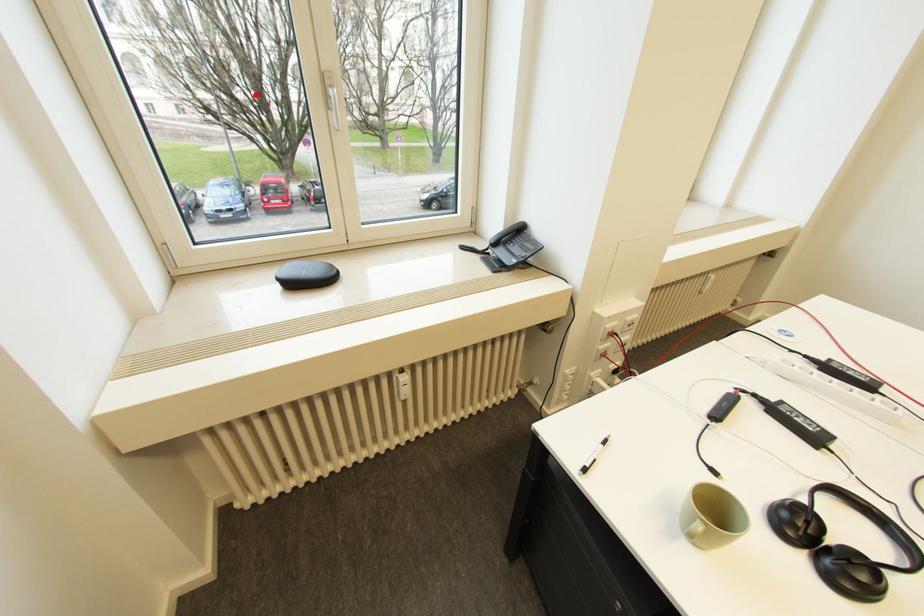
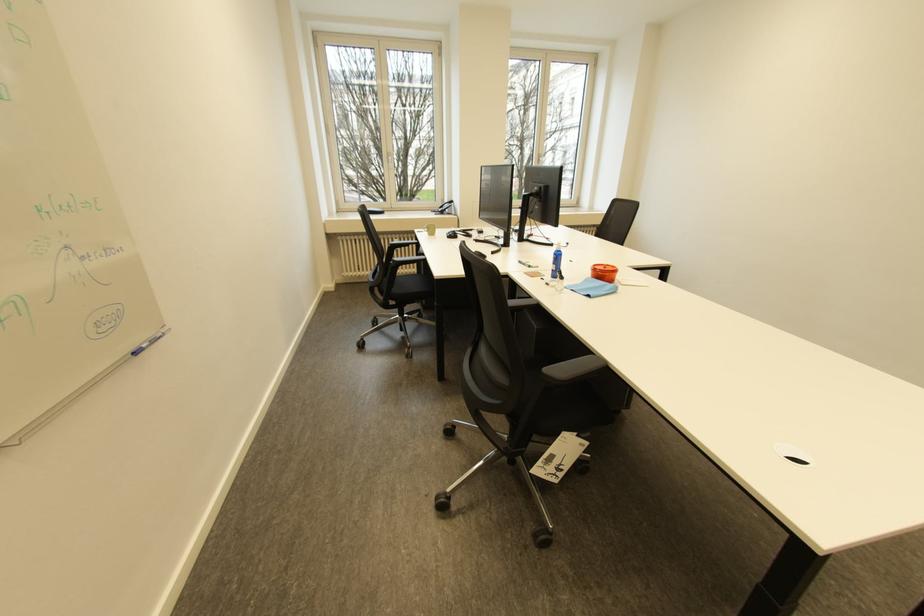
Where in the second image is the point corresponding to the highlighted location from the first image?

(386, 171)